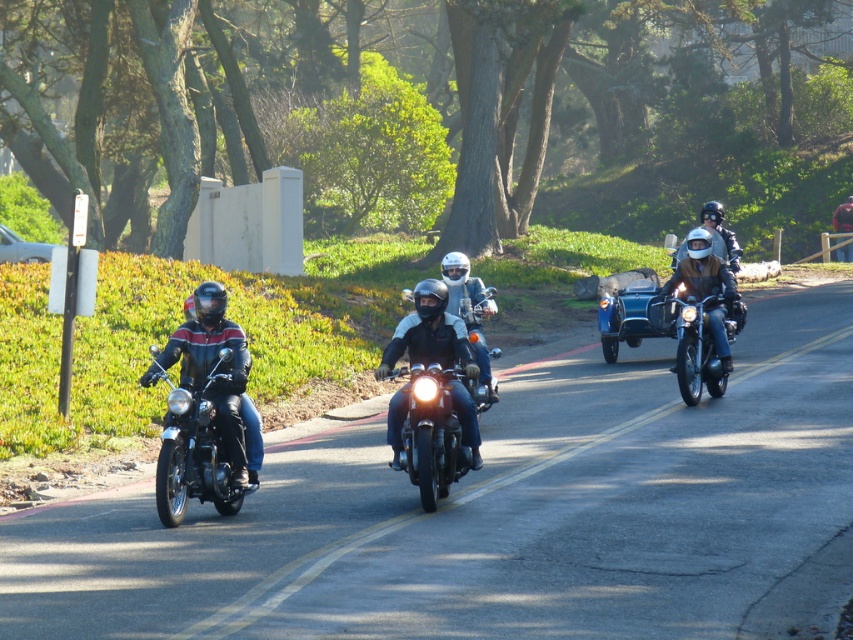
Question: Is shiny chrome motorcycle at center to the left of shiny chrome motorcycle at right from the viewer's perspective?

Choices:
 (A) no
 (B) yes

Answer: (B)

Question: Which of the following is the closest to the observer?

Choices:
 (A) (405, 456)
 (B) (711, 348)

Answer: (A)

Question: Which object appears farthest from the camera in this image?

Choices:
 (A) matte black motorcycle at right
 (B) shiny black motorcycle at left
 (C) shiny chrome motorcycle at center
 (D) shiny chrome motorcycle at right

Answer: (A)

Question: Which object appears farthest from the camera in this image?

Choices:
 (A) matte black motorcycle at right
 (B) shiny chrome motorcycle at center
 (C) shiny chrome motorcycle at right
 (D) shiny black motorcycle at left

Answer: (A)

Question: Is shiny chrome motorcycle at center below shiny chrome motorcycle at right?

Choices:
 (A) yes
 (B) no

Answer: (A)

Question: Can you confirm if shiny black motorcycle at left is positioned to the right of shiny chrome motorcycle at center?

Choices:
 (A) no
 (B) yes

Answer: (A)